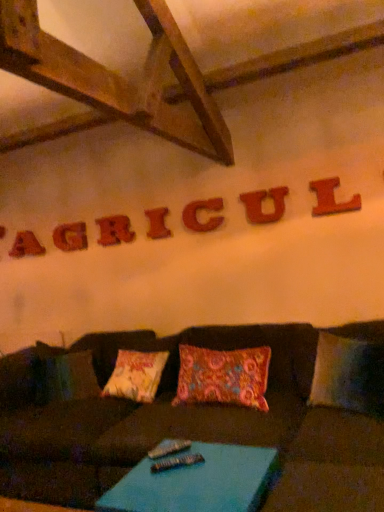
This screenshot has height=512, width=384. I want to click on blue fabric table at lower center, so click(197, 482).

Describe the element at coordinates (114, 230) in the screenshot. I see `rustic wood letter at upper center, marked as the 3th letter in a left-to-right arrangement` at that location.

What do you see at coordinates (195, 413) in the screenshot?
I see `brown fabric couch at center` at bounding box center [195, 413].

Looking at this image, measure the distance between brown fabric couch at center and camera.

The depth of brown fabric couch at center is 4.35 feet.

Describe the element at coordinates (169, 448) in the screenshot. The height and width of the screenshot is (512, 384). I see `metallic silver remote at center` at that location.

Image resolution: width=384 pixels, height=512 pixels. Identify the location of metallic silver remote at center. (169, 448).

Locate an element on the screen. The height and width of the screenshot is (512, 384). wooden letter c at center, placed as the 3th letter when sorted from front to back is located at coordinates (206, 219).

This screenshot has height=512, width=384. What do you see at coordinates (26, 245) in the screenshot? I see `red wood letter a at upper left, which is counted as the 1th letter, starting from the back` at bounding box center [26, 245].

I want to click on blue fabric table at lower center, so click(197, 482).

From the picture: Does rustic wood letter at upper center, marked as the 3th letter in a left-to-right arrangement, touch brown fabric couch at center?

rustic wood letter at upper center, marked as the 3th letter in a left-to-right arrangement, and brown fabric couch at center are clearly separated.

Is the position of rustic wood letter at upper center, marked as the third letter in a back-to-front arrangement, less distant than that of brown fabric couch at center?

No, it is not.

Considering the relative sizes of rustic wood letter at upper center, the 5th letter when ordered from front to back, and brown fabric couch at center in the image provided, is rustic wood letter at upper center, the 5th letter when ordered from front to back, smaller than brown fabric couch at center?

Yes, rustic wood letter at upper center, the 5th letter when ordered from front to back, is smaller than brown fabric couch at center.

Considering the points (123, 238) and (305, 461), which point is in front, point (123, 238) or point (305, 461)?

The point (305, 461) is closer.

Which is in front, point (123, 237) or point (202, 201)?

The point (202, 201) is in front.

From a real-world perspective, is rustic wood letter at upper center, marked as the third letter in a back-to-front arrangement, on wooden letter c at center, arranged as the 5th letter when viewed from the back?

Yes, from a real-world perspective, rustic wood letter at upper center, marked as the third letter in a back-to-front arrangement, is over wooden letter c at center, arranged as the 5th letter when viewed from the back

Is rustic wood letter at upper center, marked as the third letter in a back-to-front arrangement, oriented away from wooden letter c at center, placed as the 3th letter when sorted from front to back?

A: rustic wood letter at upper center, marked as the third letter in a back-to-front arrangement, does not have its back to wooden letter c at center, placed as the 3th letter when sorted from front to back.

From the image's perspective, relative to wooden letter c at center, the 5th letter in the left-to-right sequence, is rustic wood letter at upper center, the fifth letter when ordered from right to left, above or below?

rustic wood letter at upper center, the fifth letter when ordered from right to left, is situated lower than wooden letter c at center, the 5th letter in the left-to-right sequence, in the image.

Is wooden letter l at upper right, which appears as the 1th letter when viewed from the front, behind blue fabric table at lower center?

That is True.

Is wooden letter l at upper right, the seventh letter when ordered from back to front, thinner than blue fabric table at lower center?

Indeed, wooden letter l at upper right, the seventh letter when ordered from back to front, has a lesser width compared to blue fabric table at lower center.

Considering the sizes of objects wooden letter l at upper right, the seventh letter when ordered from back to front, and blue fabric table at lower center in the image provided, who is smaller, wooden letter l at upper right, the seventh letter when ordered from back to front, or blue fabric table at lower center?

wooden letter l at upper right, the seventh letter when ordered from back to front.

Considering the positions of objects wooden letter l at upper right, positioned as the 1th letter in right-to-left order, and blue fabric table at lower center in the image provided, who is more to the right, wooden letter l at upper right, positioned as the 1th letter in right-to-left order, or blue fabric table at lower center?

wooden letter l at upper right, positioned as the 1th letter in right-to-left order, is more to the right.

Could you tell me if red wood letter a at upper left, which is counted as the 1th letter, starting from the back, is facing metallic silver remote at center?

No, red wood letter a at upper left, which is counted as the 1th letter, starting from the back, does not turn towards metallic silver remote at center.

From a real-world perspective, is red wood letter a at upper left, positioned as the seventh letter in front-to-back order, above or below metallic silver remote at center?

Clearly, from a real-world perspective, red wood letter a at upper left, positioned as the seventh letter in front-to-back order, is above metallic silver remote at center.

Is red wood letter a at upper left, which is counted as the seventh letter, starting from the right, taller than metallic silver remote at center?

Yes, red wood letter a at upper left, which is counted as the seventh letter, starting from the right, is taller than metallic silver remote at center.

Looking at their sizes, would you say red wood letter a at upper left, which is counted as the seventh letter, starting from the right, is wider or thinner than metallic silver remote at center?

Clearly, red wood letter a at upper left, which is counted as the seventh letter, starting from the right, has less width compared to metallic silver remote at center.

From a real-world perspective, which object rests below the other?

blue fabric table at lower center.

Which is more to the right, matte wooden letter at upper center, placed as the second letter when sorted from back to front, or blue fabric table at lower center?

blue fabric table at lower center is more to the right.

Is matte wooden letter at upper center, arranged as the sixth letter when viewed from the right, taller than blue fabric table at lower center?

In fact, matte wooden letter at upper center, arranged as the sixth letter when viewed from the right, may be shorter than blue fabric table at lower center.

Can you confirm if matte wooden letter at upper center, arranged as the sixth letter when viewed from the right, is wider than blue fabric table at lower center?

No, matte wooden letter at upper center, arranged as the sixth letter when viewed from the right, is not wider than blue fabric table at lower center.

Which is behind, point (187, 211) or point (313, 428)?

Point (187, 211)

Which object is positioned more to the left, wooden letter c at center, the third letter in the right-to-left sequence, or brown fabric couch at center?

From the viewer's perspective, brown fabric couch at center appears more on the left side.

Could brown fabric couch at center be considered to be inside wooden letter c at center, the third letter in the right-to-left sequence?

Actually, brown fabric couch at center is outside wooden letter c at center, the third letter in the right-to-left sequence.

Is wooden letter c at center, the 5th letter in the left-to-right sequence, directly adjacent to brown fabric couch at center?

No, wooden letter c at center, the 5th letter in the left-to-right sequence, is not beside brown fabric couch at center.

In terms of size, does matte wooden letter at upper center, marked as the 6th letter in a front-to-back arrangement, appear bigger or smaller than brown fabric couch at center?

matte wooden letter at upper center, marked as the 6th letter in a front-to-back arrangement, is smaller than brown fabric couch at center.

Considering the relative sizes of matte wooden letter at upper center, placed as the second letter when sorted from back to front, and brown fabric couch at center in the image provided, is matte wooden letter at upper center, placed as the second letter when sorted from back to front, taller than brown fabric couch at center?

In fact, matte wooden letter at upper center, placed as the second letter when sorted from back to front, may be shorter than brown fabric couch at center.

Which is more to the right, matte wooden letter at upper center, arranged as the sixth letter when viewed from the right, or brown fabric couch at center?

brown fabric couch at center.

At what (x,y) coordinates should I click in order to perform the action: click on studio couch below the rustic wood letter at upper center, the fifth letter when ordered from right to left (from the image's perspective). Please return your answer as a coordinate pair (x, y). Looking at the image, I should click on (195, 413).

Find the location of a particular element. the 2nd letter above the rustic wood letter at upper center, marked as the third letter in a back-to-front arrangement (from the image's perspective) is located at coordinates (206, 219).

When comparing their distances from blue fabric table at lower center, does metallic silver remote at center or matte wooden letter at upper center, placed as the second letter when sorted from back to front, seem further?

The object further to blue fabric table at lower center is matte wooden letter at upper center, placed as the second letter when sorted from back to front.

Based on their spatial positions, is wooden letter c at center, the third letter in the right-to-left sequence, or metallic silver remote at center further from brown fabric couch at center?

wooden letter c at center, the third letter in the right-to-left sequence, is positioned further to the anchor brown fabric couch at center.

From the image, which object appears to be nearer to red wood letter a at upper left, which is counted as the first letter, starting from the left, wooden letter c at center, the 5th letter in the left-to-right sequence, or wooden letter u at center, the sixth letter viewed from the left?

wooden letter c at center, the 5th letter in the left-to-right sequence, lies closer to red wood letter a at upper left, which is counted as the first letter, starting from the left, than the other object.

Based on their spatial positions, is wooden letter l at upper right, which appears as the 1th letter when viewed from the front, or metallic silver remote at center further from wooden letter i at center, the fourth letter when ordered from back to front?

Based on the image, metallic silver remote at center appears to be further to wooden letter i at center, the fourth letter when ordered from back to front.

Estimate the real-world distances between objects in this image. Which object is further from wooden letter i at center, the 4th letter viewed from the left, matte wooden letter at upper center, marked as the 6th letter in a front-to-back arrangement, or red wood letter a at upper left, which is counted as the 1th letter, starting from the back?

red wood letter a at upper left, which is counted as the 1th letter, starting from the back, is further to wooden letter i at center, the 4th letter viewed from the left.

Which object lies further to the anchor point wooden letter u at center, the 2th letter positioned from the front, matte wooden letter at upper center, placed as the second letter when sorted from back to front, or metallic silver remote at center?

metallic silver remote at center is positioned further to the anchor wooden letter u at center, the 2th letter positioned from the front.

Estimate the real-world distances between objects in this image. Which object is further from wooden letter i at center, marked as the fourth letter in a front-to-back arrangement, wooden letter l at upper right, positioned as the 1th letter in right-to-left order, or wooden letter u at center, the sixth letter viewed from the back?

Based on the image, wooden letter l at upper right, positioned as the 1th letter in right-to-left order, appears to be further to wooden letter i at center, marked as the fourth letter in a front-to-back arrangement.

Estimate the real-world distances between objects in this image. Which object is closer to blue fabric table at lower center, wooden letter l at upper right, positioned as the 1th letter in right-to-left order, or wooden letter c at center, the third letter in the right-to-left sequence?

wooden letter l at upper right, positioned as the 1th letter in right-to-left order, lies closer to blue fabric table at lower center than the other object.

This screenshot has width=384, height=512. In order to click on remote between red wood letter a at upper left, positioned as the seventh letter in front-to-back order, and wooden letter l at upper right, the seventh letter when ordered from back to front in this screenshot , I will do `click(169, 448)`.

What are the coordinates of `letter between rustic wood letter at upper center, marked as the 3th letter in a left-to-right arrangement, and wooden letter c at center, placed as the 3th letter when sorted from front to back, from left to right` in the screenshot? It's located at (157, 223).

Locate an element on the screen. The width and height of the screenshot is (384, 512). remote located between blue fabric table at lower center and wooden letter c at center, the third letter in the right-to-left sequence, in the depth direction is located at coordinates (169, 448).

What are the coordinates of `remote positioned between blue fabric table at lower center and matte wooden letter at upper center, placed as the second letter when sorted from back to front, from near to far` in the screenshot? It's located at (169, 448).